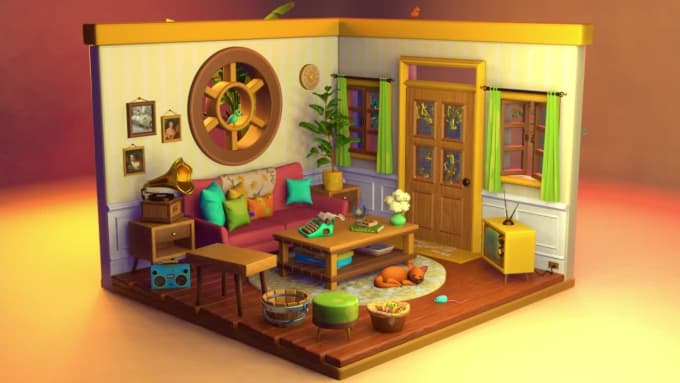
You are a GUI agent. You are given a task and a screenshot of the screen. Output one action in this format:
    pyautogui.click(x=<x>, y=<y>)
    Task: Click on the door
    
    Given the screenshot: What is the action you would take?
    pyautogui.click(x=436, y=160)